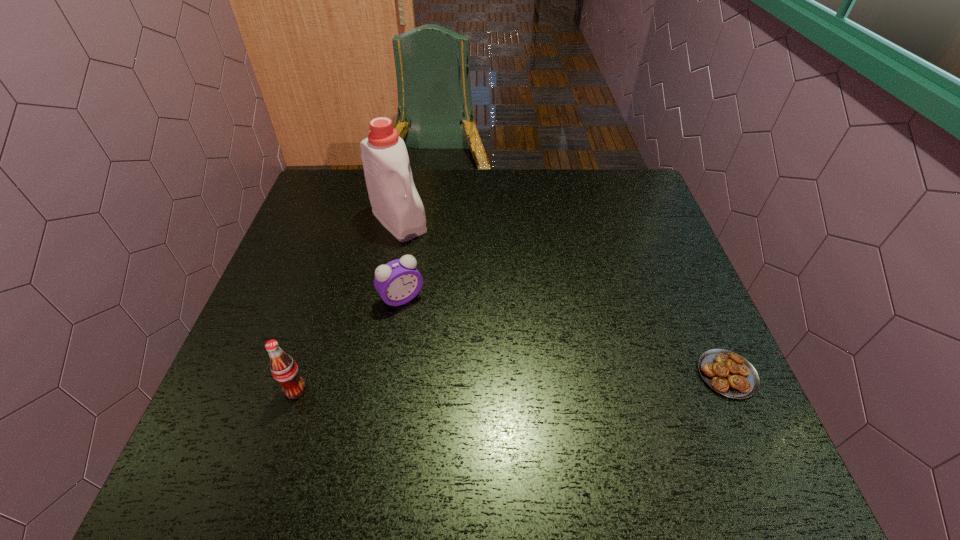
Find the location of a particular element. the third closest object relative to the soda is located at coordinates (728, 373).

In order to click on vacant space that satisfies the following two spatial constraints: 1. on the back side of the leftmost object; 2. on the right side of the third nearest object in this screenshot , I will do `click(325, 298)`.